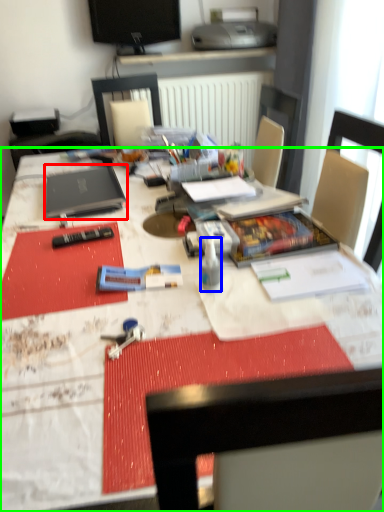
Question: Which object is positioned closest to laptop (highlighted by a red box)? Select from bottle (highlighted by a blue box) and desk (highlighted by a green box).

Choices:
 (A) bottle
 (B) desk

Answer: (B)